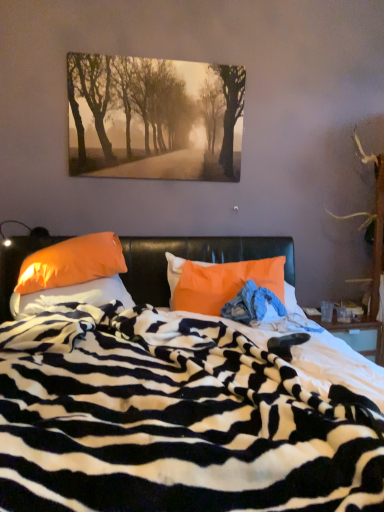
Question: Is orange fabric pillow at center, arranged as the third pillow when viewed from the left, shorter than orange fabric pillow at left, which is the 2th pillow in right-to-left order?

Choices:
 (A) no
 (B) yes

Answer: (A)

Question: Is orange fabric pillow at center, arranged as the first pillow when viewed from the right, smaller than orange fabric pillow at left, which is the 2th pillow in right-to-left order?

Choices:
 (A) yes
 (B) no

Answer: (A)

Question: Is orange fabric pillow at center, arranged as the first pillow when viewed from the right, positioned with its back to orange fabric pillow at left, acting as the 2th pillow starting from the left?

Choices:
 (A) yes
 (B) no

Answer: (B)

Question: From the image's perspective, does orange fabric pillow at center, arranged as the third pillow when viewed from the left, appear higher than orange fabric pillow at left, which is the 2th pillow in right-to-left order?

Choices:
 (A) yes
 (B) no

Answer: (B)

Question: Is orange fabric pillow at center, arranged as the third pillow when viewed from the left, taller than orange fabric pillow at left, which is the 2th pillow in right-to-left order?

Choices:
 (A) yes
 (B) no

Answer: (A)

Question: Is orange fabric pillow at left, which is the 2th pillow in right-to-left order, completely or partially inside orange fabric pillow at center, arranged as the third pillow when viewed from the left?

Choices:
 (A) yes
 (B) no

Answer: (B)

Question: Is blue denim jeans at center facing towards orange fabric pillow at left, arranged as the 3th pillow when viewed from the right?

Choices:
 (A) yes
 (B) no

Answer: (B)

Question: Considering the relative sizes of blue denim jeans at center and orange fabric pillow at left, arranged as the 3th pillow when viewed from the right, in the image provided, is blue denim jeans at center taller than orange fabric pillow at left, arranged as the 3th pillow when viewed from the right,?

Choices:
 (A) no
 (B) yes

Answer: (A)

Question: From a real-world perspective, is blue denim jeans at center positioned under orange fabric pillow at left, arranged as the 3th pillow when viewed from the right, based on gravity?

Choices:
 (A) yes
 (B) no

Answer: (B)

Question: Are blue denim jeans at center and orange fabric pillow at left, arranged as the 3th pillow when viewed from the right, making contact?

Choices:
 (A) no
 (B) yes

Answer: (A)

Question: Does blue denim jeans at center lie in front of orange fabric pillow at left, arranged as the 3th pillow when viewed from the right?

Choices:
 (A) yes
 (B) no

Answer: (B)

Question: From the image's perspective, does blue denim jeans at center appear lower than orange fabric pillow at left, placed as the 1th pillow when sorted from left to right?

Choices:
 (A) no
 (B) yes

Answer: (B)

Question: Does orange fabric pillow at left, arranged as the 3th pillow when viewed from the right, have a greater height compared to blue denim jeans at center?

Choices:
 (A) yes
 (B) no

Answer: (A)